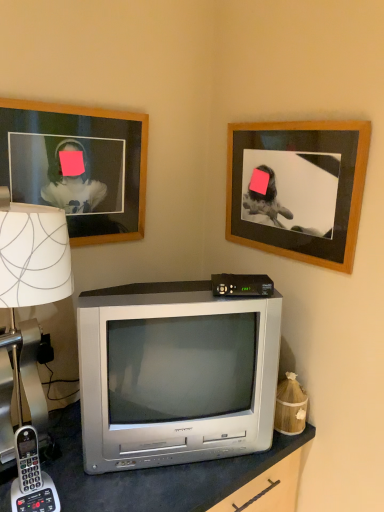
Question: Could you tell me if black plastic/cable box at center is facing gray plastic phone at lower left?

Choices:
 (A) yes
 (B) no

Answer: (B)

Question: From a real-world perspective, is black plastic/cable box at center over gray plastic phone at lower left?

Choices:
 (A) yes
 (B) no

Answer: (A)

Question: From the image's perspective, would you say black plastic/cable box at center is positioned over gray plastic phone at lower left?

Choices:
 (A) no
 (B) yes

Answer: (B)

Question: Is black plastic/cable box at center shorter than gray plastic phone at lower left?

Choices:
 (A) yes
 (B) no

Answer: (A)

Question: Is black plastic/cable box at center further to the viewer compared to gray plastic phone at lower left?

Choices:
 (A) yes
 (B) no

Answer: (A)

Question: Are black plastic/cable box at center and gray plastic phone at lower left located far from each other?

Choices:
 (A) yes
 (B) no

Answer: (B)

Question: Considering the relative positions of black plastic/cable box at center and wooden frame at upper right, placed as the second picture frame when sorted from left to right, in the image provided, is black plastic/cable box at center to the left of wooden frame at upper right, placed as the second picture frame when sorted from left to right, from the viewer's perspective?

Choices:
 (A) yes
 (B) no

Answer: (A)

Question: Does black plastic/cable box at center lie behind wooden frame at upper right, placed as the second picture frame when sorted from left to right?

Choices:
 (A) yes
 (B) no

Answer: (A)

Question: Is black plastic/cable box at center far from wooden frame at upper right, placed as the second picture frame when sorted from left to right?

Choices:
 (A) yes
 (B) no

Answer: (B)

Question: Is black plastic/cable box at center turned away from wooden frame at upper right, placed as the second picture frame when sorted from left to right?

Choices:
 (A) yes
 (B) no

Answer: (B)

Question: Are black plastic/cable box at center and wooden frame at upper right, the 1th picture frame positioned from the right, beside each other?

Choices:
 (A) yes
 (B) no

Answer: (B)

Question: Is black plastic/cable box at center smaller than wooden frame at upper right, the 1th picture frame positioned from the right?

Choices:
 (A) no
 (B) yes

Answer: (B)

Question: Considering the relative sizes of white paper lampshade at left and silver metallic television at center in the image provided, is white paper lampshade at left thinner than silver metallic television at center?

Choices:
 (A) no
 (B) yes

Answer: (A)